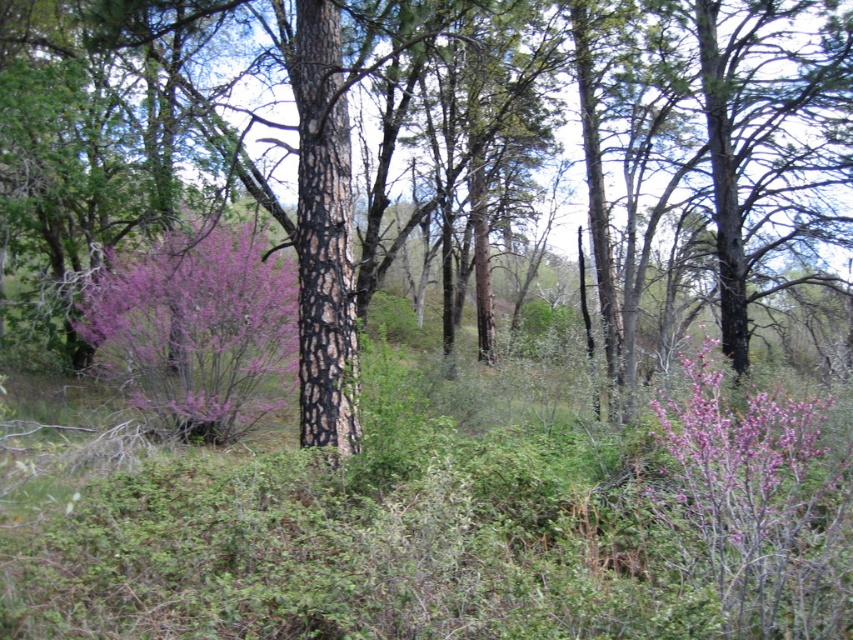
Does point (285, 333) come in front of point (738, 522)?

That is False.

Is purple matte bush at left closer to the viewer compared to purple bloom at right?

No, purple matte bush at left is behind purple bloom at right.

You are a GUI agent. You are given a task and a screenshot of the screen. Output one action in this format:
    pyautogui.click(x=<x>, y=<y>)
    Task: Click on the purple matte bush at left
    The width and height of the screenshot is (853, 640).
    Given the screenshot: What is the action you would take?
    pyautogui.click(x=196, y=330)

The width and height of the screenshot is (853, 640). Identify the location of purple matte bush at left. (196, 330).

Who is higher up, brown rough bark tree at center or purple bloom at right?

brown rough bark tree at center

Can you confirm if brown rough bark tree at center is positioned above purple bloom at right?

Correct, brown rough bark tree at center is located above purple bloom at right.

Where is `brown rough bark tree at center`? brown rough bark tree at center is located at coordinates (430, 152).

Can you confirm if brown rough bark tree at center is thinner than purple matte bush at left?

In fact, brown rough bark tree at center might be wider than purple matte bush at left.

Who is more distant from viewer, (x=318, y=154) or (x=160, y=292)?

The point (x=160, y=292) is behind.

Describe the element at coordinates (430, 152) in the screenshot. The height and width of the screenshot is (640, 853). I see `brown rough bark tree at center` at that location.

The width and height of the screenshot is (853, 640). Find the location of `brown rough bark tree at center`. brown rough bark tree at center is located at coordinates (430, 152).